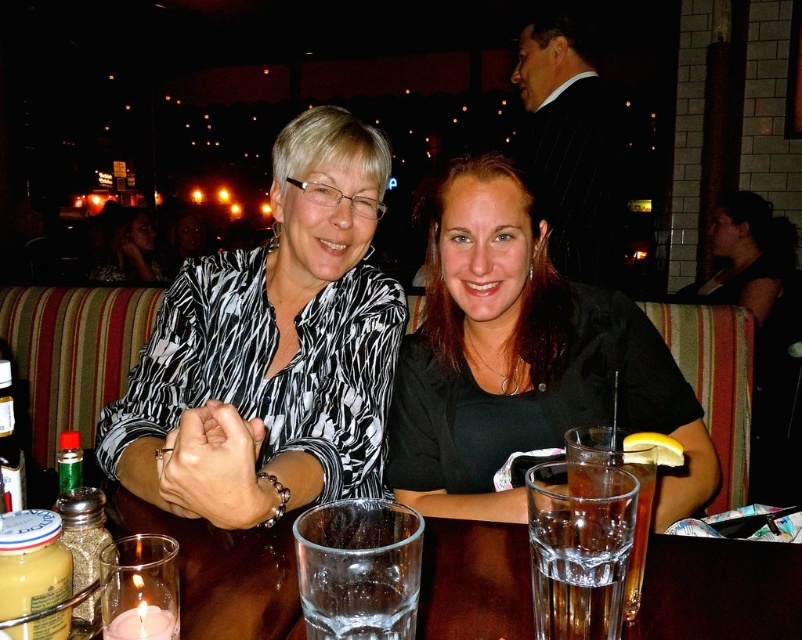
Question: Which object is the closest to the black suit at upper center?

Choices:
 (A) smooth skin face at upper left
 (B) black matte shirt at center
 (C) printed fabric blouse at center

Answer: (B)

Question: Which object is the closest to the black matte shirt at center?

Choices:
 (A) printed fabric blouse at center
 (B) black suit at upper center

Answer: (A)

Question: Does clear glass at center have a larger size compared to smooth skin face at upper left?

Choices:
 (A) yes
 (B) no

Answer: (B)

Question: Is clear glass at center below smooth skin face at upper left?

Choices:
 (A) no
 (B) yes

Answer: (B)

Question: From the image, what is the correct spatial relationship of black suit at upper center in relation to smooth skin face at upper left?

Choices:
 (A) right
 (B) left

Answer: (A)

Question: Which of the following is the farthest from the observer?

Choices:
 (A) transparent glass at lower center
 (B) clear glass at center

Answer: (B)